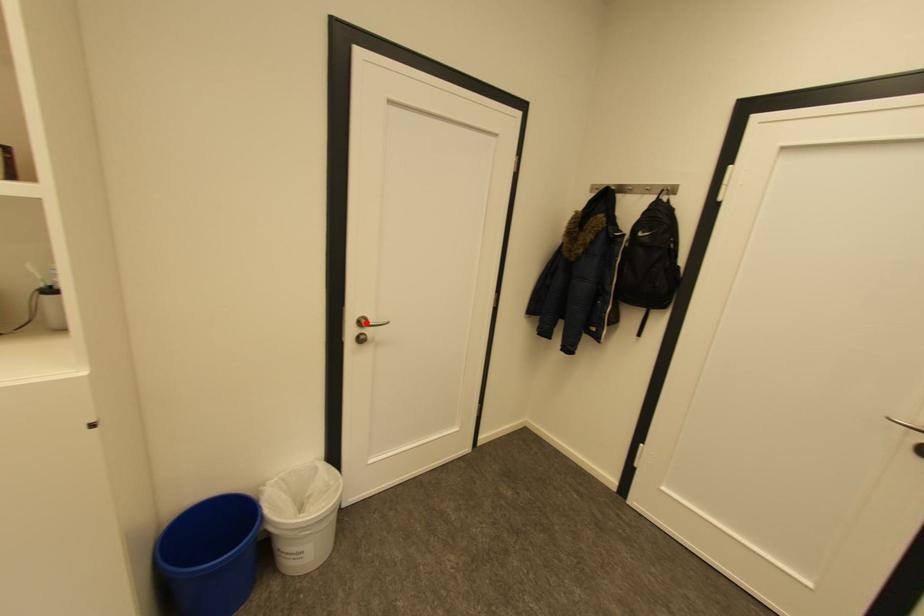
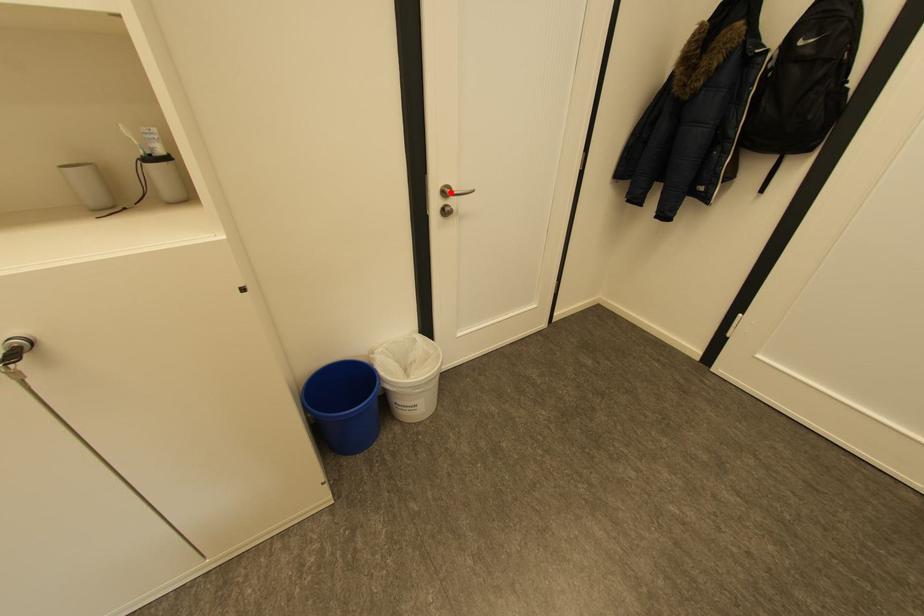
I am providing you with two images of the same scene from different viewpoints. A red point is marked on the first image and another point is marked on the second image. Is the red point in image1 aligned with the point shown in image2?

Yes